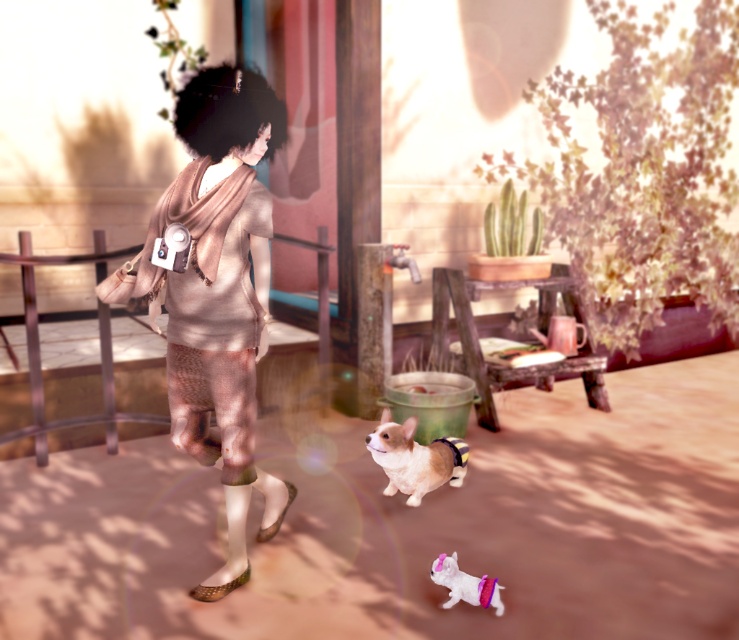
From the picture: You are organizing a fashion show and need to decide which item to display first. According to the scene, which item is bigger between the matte beige dress at center and the soft beige fur at center?

The matte beige dress at center is larger in size than the soft beige fur at center, so it should be displayed first.

You are a photographer trying to capture a photo of the soft beige fur at center and the white fabric dog at lower center. Which object should you focus on first if you want to ensure both are in the frame without moving the camera? Explain your reasoning based on their sizes.

The soft beige fur at center is bigger than the white fabric dog at lower center. Therefore, you should focus on the soft beige fur at center first since it occupies more space in the frame, ensuring it is centered properly before adjusting for the smaller white fabric dog at lower center.